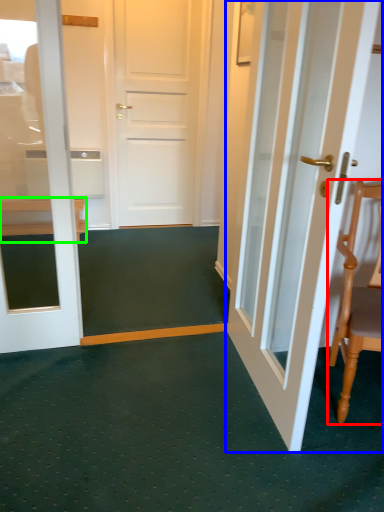
Question: Which object is the farthest from chair (highlighted by a red box)? Choose among these: door (highlighted by a blue box) or furniture (highlighted by a green box).

Choices:
 (A) door
 (B) furniture

Answer: (B)